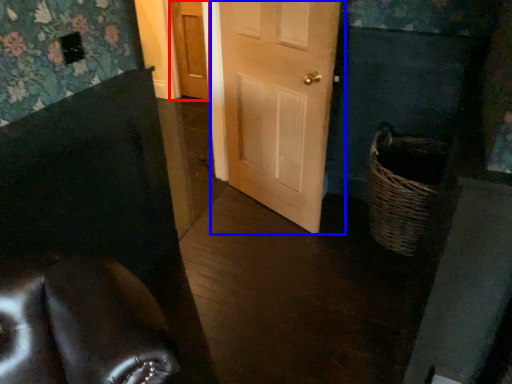
Question: Which object appears closest to the camera in this image, door (highlighted by a red box) or door (highlighted by a blue box)?

Choices:
 (A) door
 (B) door

Answer: (B)